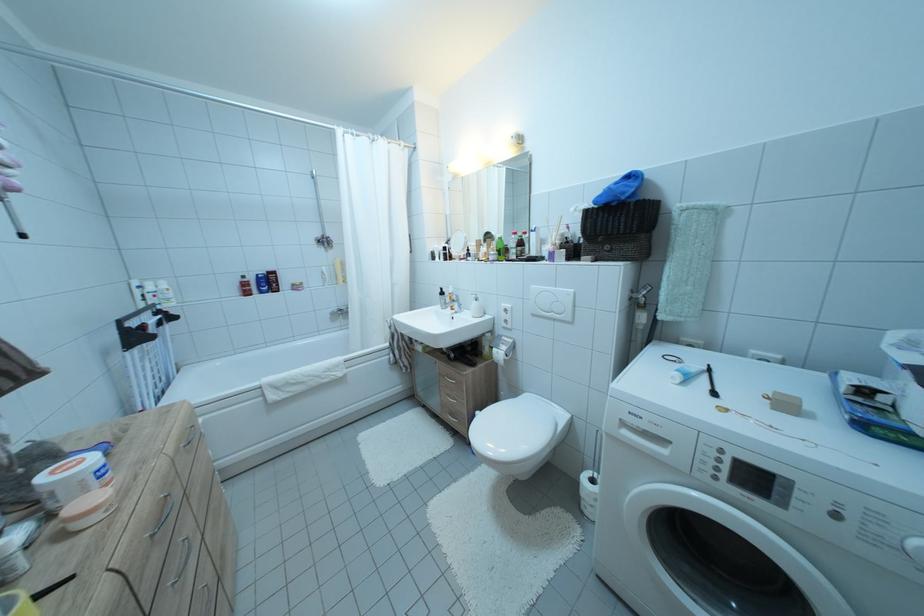
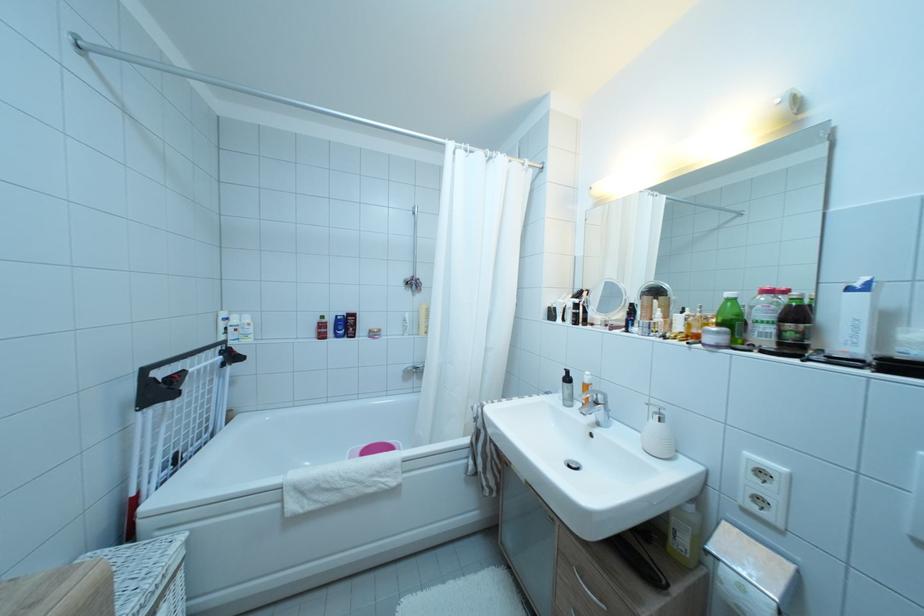
Where in the second image is the point corresponding to [266,292] from the first image?

(343, 334)